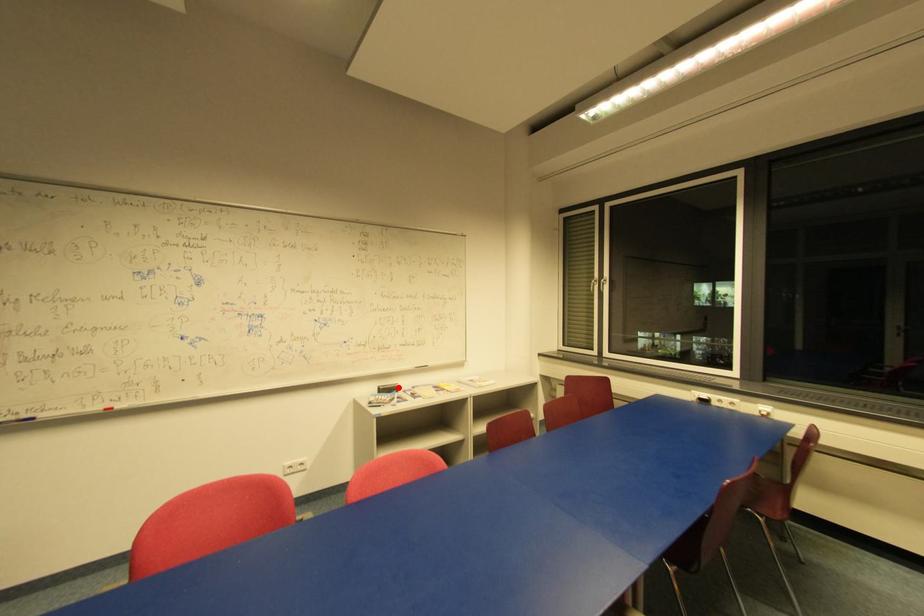
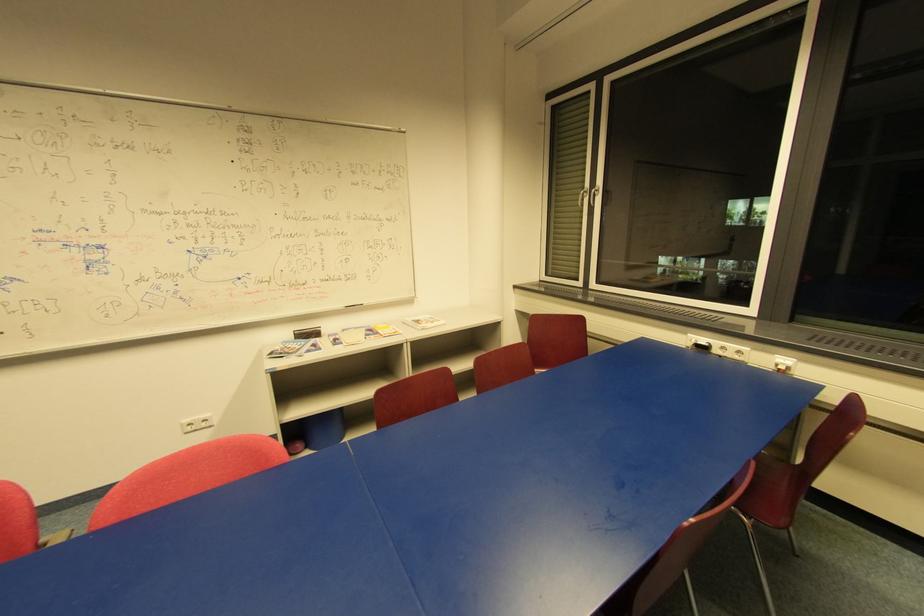
In the second image, find the point that corresponds to the highlighted location in the first image.

(319, 331)